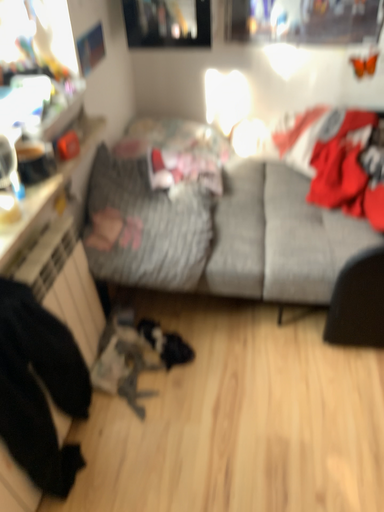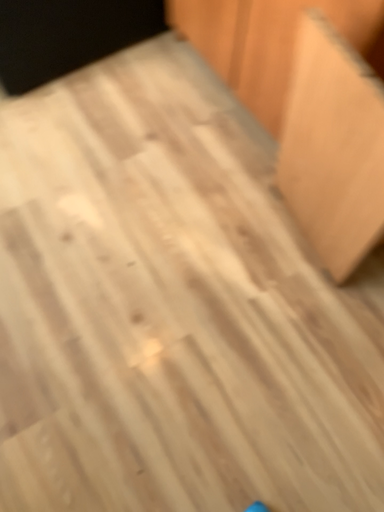
Question: How did the camera likely rotate when shooting the video?

Choices:
 (A) rotated downward
 (B) rotated upward

Answer: (A)